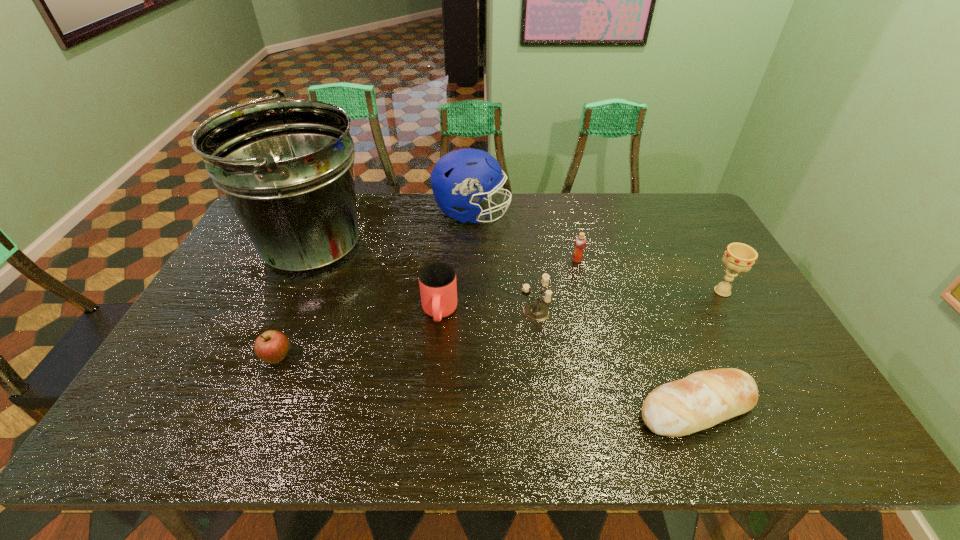
Where is `vacant area that lies between the candle holder and the cup`? The width and height of the screenshot is (960, 540). vacant area that lies between the candle holder and the cup is located at coordinates (487, 312).

Locate which object ranks seventh in proximity to the orange juice. Please provide its 2D coordinates. Your answer should be formatted as a tuple, i.e. [(x, y)], where the tuple contains the x and y coordinates of a point satisfying the conditions above.

[(272, 346)]

Locate an element on the screen. The image size is (960, 540). object identified as the seventh closest to the orange juice is located at coordinates (272, 346).

Locate an element on the screen. vacant area that satisfies the following two spatial constraints: 1. on the back side of the rightmost object; 2. on the front-facing side of the football helmet is located at coordinates (678, 213).

At what (x,y) coordinates should I click in order to perform the action: click on vacant region that satisfies the following two spatial constraints: 1. on the back side of the candle holder; 2. on the right side of the chalice. Please return your answer as a coordinate pair (x, y). Image resolution: width=960 pixels, height=540 pixels. Looking at the image, I should click on (533, 291).

This screenshot has height=540, width=960. Identify the location of free location that satisfies the following two spatial constraints: 1. on the back side of the orange juice; 2. on the front-facing side of the seventh shortest object. (565, 213).

Identify the location of free space that satisfies the following two spatial constraints: 1. on the front-facing side of the rightmost object; 2. on the left side of the seventh shortest object. This screenshot has height=540, width=960. (470, 291).